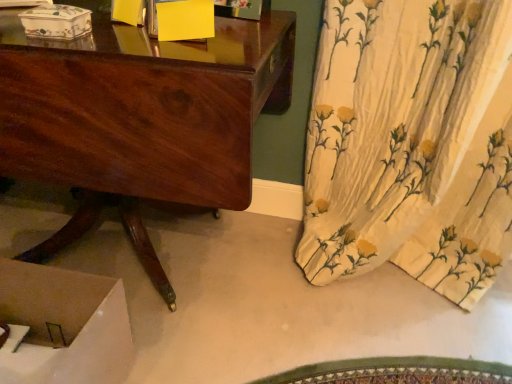
Locate an element on the screen. The image size is (512, 384). vacant area that lies to the right of yellow paper at upper center, which is counted as the first box, starting from the right is located at coordinates (244, 44).